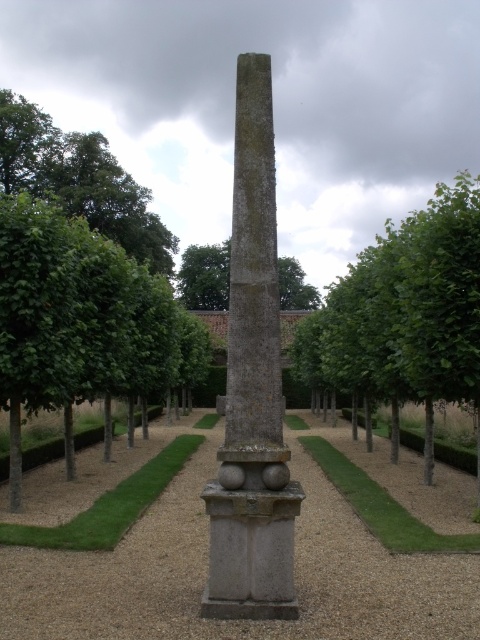
Question: Which of the following is the closest to the observer?

Choices:
 (A) gray stone obelisk at center
 (B) green leafy tree at upper center

Answer: (B)

Question: Which object is closer to the camera taking this photo?

Choices:
 (A) gray stone obelisk at center
 (B) green leafy tree at left
 (C) smooth gravel path at center

Answer: (C)

Question: Does smooth gravel path at center have a smaller size compared to green leafy tree at center?

Choices:
 (A) no
 (B) yes

Answer: (B)

Question: Can you confirm if smooth gravel path at center is thinner than green leafy tree at center?

Choices:
 (A) no
 (B) yes

Answer: (B)

Question: Is green leafy tree at center positioned in front of green leafy tree at upper center?

Choices:
 (A) no
 (B) yes

Answer: (A)

Question: Which point appears closest to the camera in this image?

Choices:
 (A) (336, 596)
 (B) (465, 339)
 (C) (180, 298)

Answer: (A)